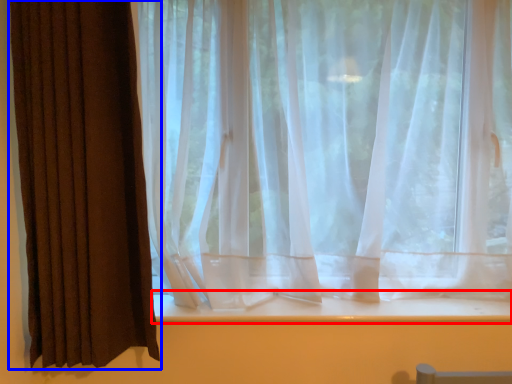
Question: Among these objects, which one is nearest to the camera, window sill (highlighted by a red box) or curtain (highlighted by a blue box)?

Choices:
 (A) window sill
 (B) curtain

Answer: (B)